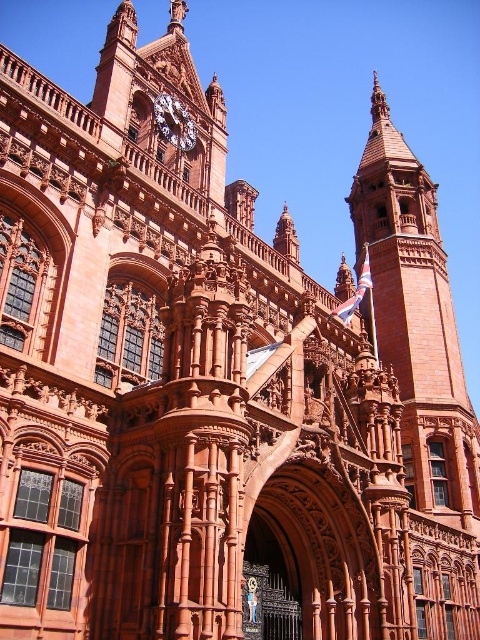
You are standing in front of the historic building and want to locate the brick tower at upper right. According to the coordinates provided, where exactly would you look on the building?

The brick tower at upper right is located at coordinates point (417,321) on the building.

You are an architect assessing the building for maintenance. You need to determine which structure requires a taller ladder for repairs between the brick tower at upper right and the polished brass clock at upper center. Which one do you choose?

The brick tower at upper right is taller than the polished brass clock at upper center, so you should choose a taller ladder for the brick tower at upper right.